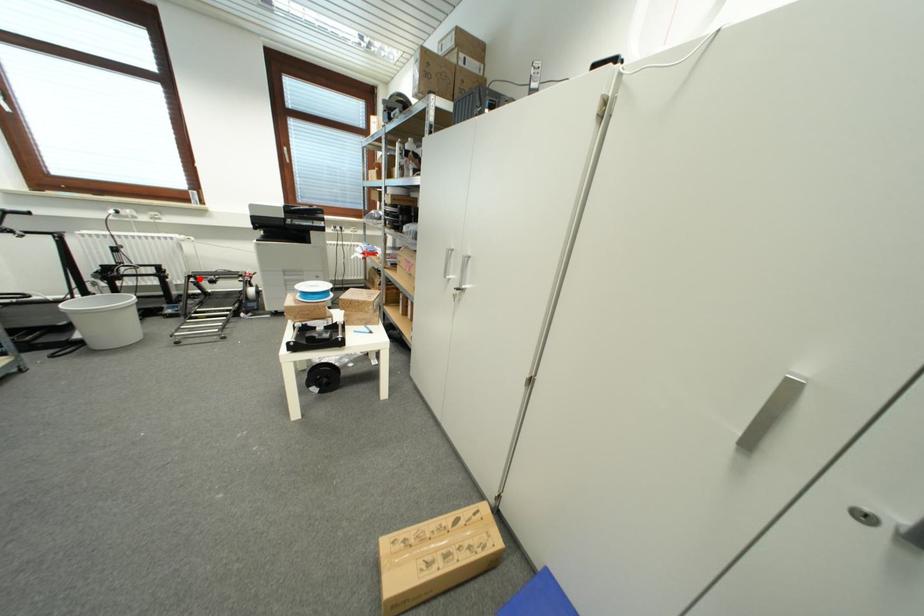
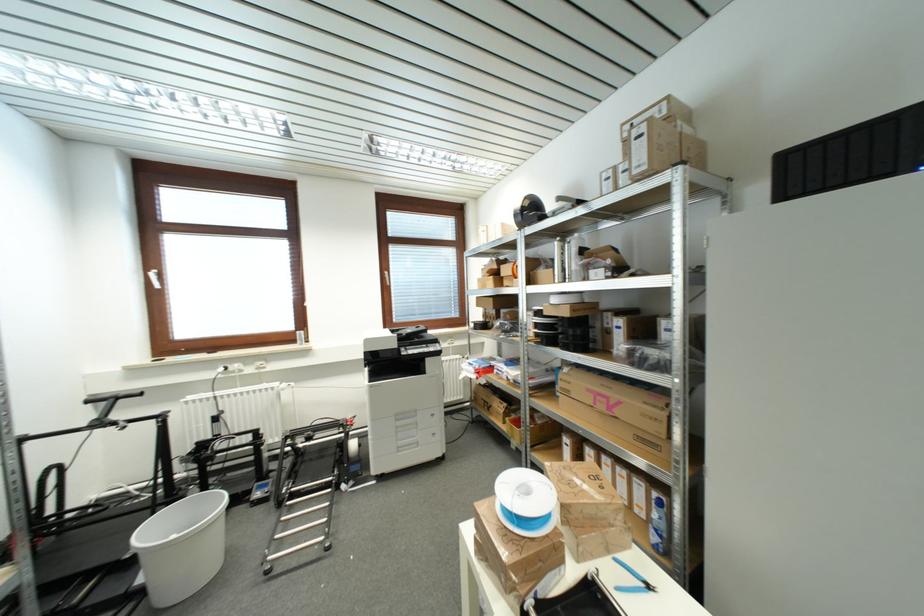
Locate, in the second image, the point that corresponds to the highlighted location in the first image.

(297, 438)